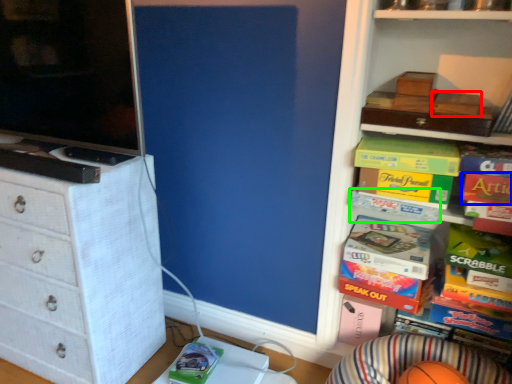
Question: Considering the real-world distances, which object is closest to storage box (highlighted by a red box)? book (highlighted by a blue box) or book (highlighted by a green box).

Choices:
 (A) book
 (B) book

Answer: (A)